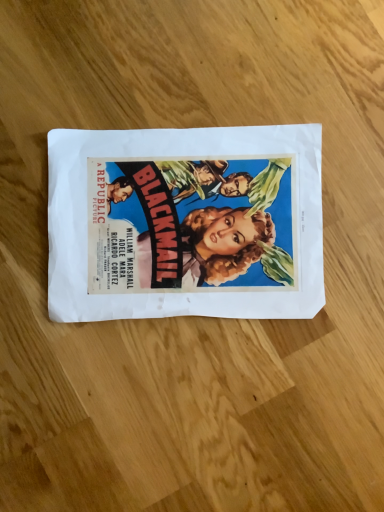
What do you see at coordinates (185, 223) in the screenshot? Image resolution: width=384 pixels, height=512 pixels. I see `matte paper poster at center` at bounding box center [185, 223].

Locate an element on the screen. Image resolution: width=384 pixels, height=512 pixels. matte paper poster at center is located at coordinates (185, 223).

Where is `matte paper poster at center`? This screenshot has height=512, width=384. matte paper poster at center is located at coordinates (185, 223).